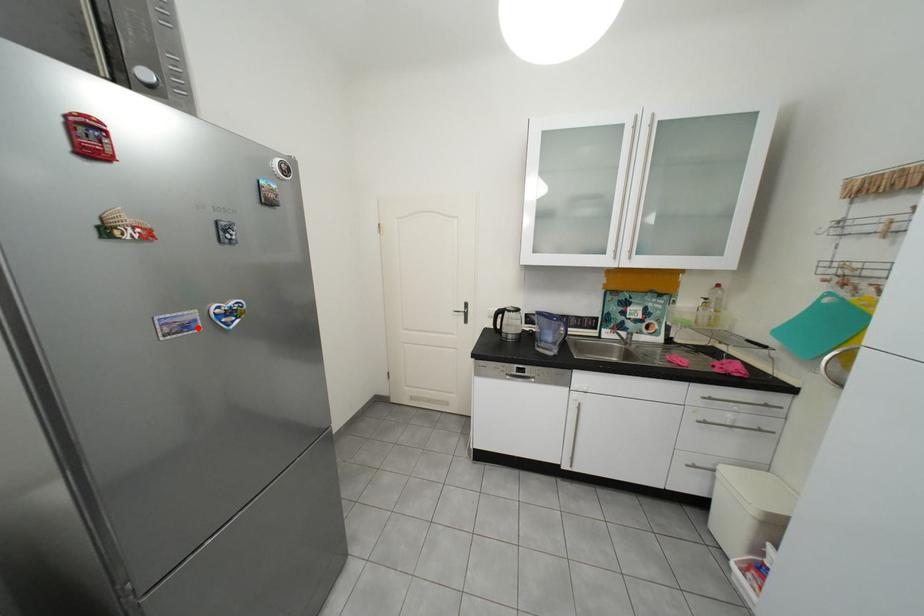
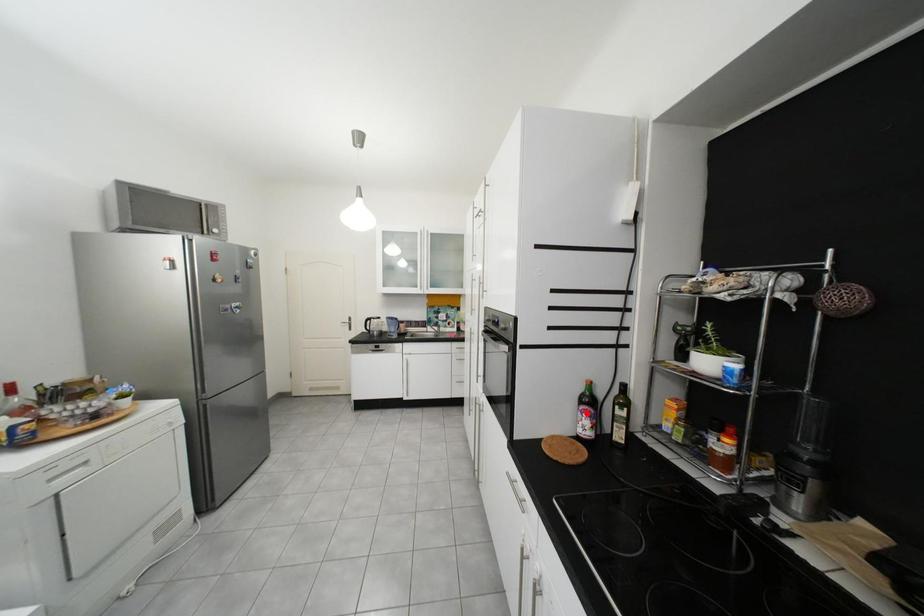
I am providing you with two images of the same scene from different viewpoints. A red point is marked on the first image and another point is marked on the second image. Does the point marked in image1 correspond to the same location as the one in image2?

No